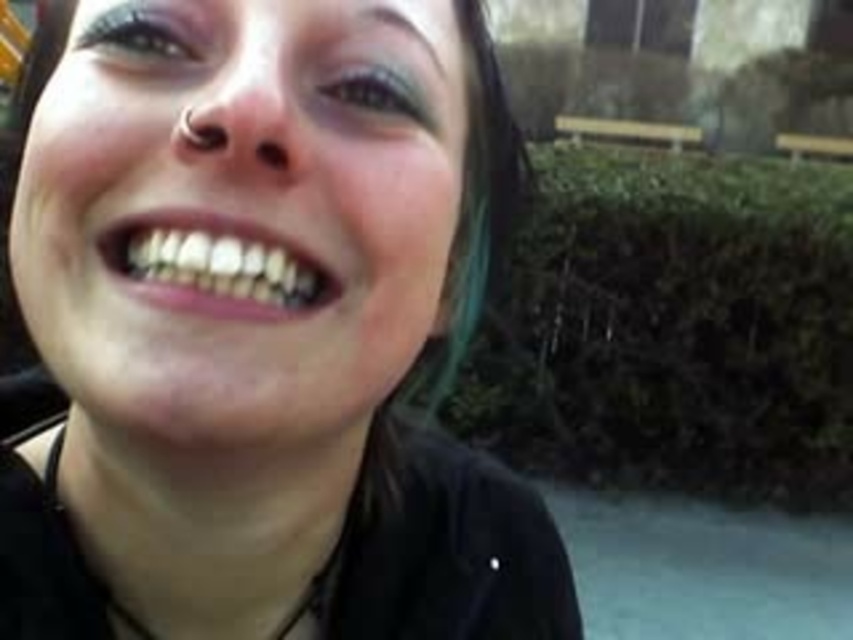
Question: Does matte black face at center have a smaller size compared to dark brown eyebrow at upper center?

Choices:
 (A) no
 (B) yes

Answer: (A)

Question: Which point is farther to the camera?

Choices:
 (A) (190, 58)
 (B) (398, 24)
 (C) (10, 68)

Answer: (C)

Question: Which is nearer to the matte black face at center?

Choices:
 (A) green matte eye at upper center
 (B) dark brown eyebrow at upper center

Answer: (B)

Question: Does matte black face at center appear on the left side of dark brown eyebrow at upper center?

Choices:
 (A) yes
 (B) no

Answer: (A)

Question: Which of the following is the farthest from the observer?

Choices:
 (A) (154, 52)
 (B) (22, 116)
 (C) (450, 12)
 (D) (350, 83)

Answer: (B)

Question: Does matte black face at center appear under dark brown eyebrow at upper center?

Choices:
 (A) yes
 (B) no

Answer: (A)